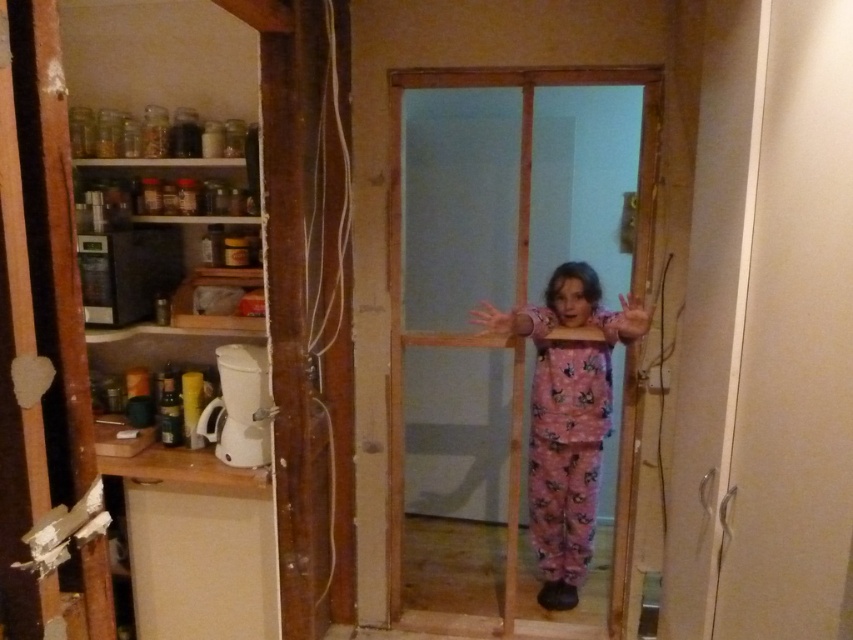
You are a parent trying to ensure your child stays safe while playing in this construction zone. The transparent glass door at center and the pink fuzzy jumpsuit at center are both in the area. Which object is taller and could pose a potential hazard if the child runs into it?

The transparent glass door at center is much taller than the pink fuzzy jumpsuit at center, so it could pose a potential hazard if the child runs into it.

You are a parent trying to dress your child for a cold winter day. You have two options available in the room depicted in the scene. Which of the two items, the pink cotton pajamas at center or the pink fuzzy jumpsuit at center, would be more appropriate based on their size?

The pink fuzzy jumpsuit at center is narrower than the pink cotton pajamas at center, so the pink fuzzy jumpsuit at center would be more appropriate for a cold day since it is tighter and provides better insulation.